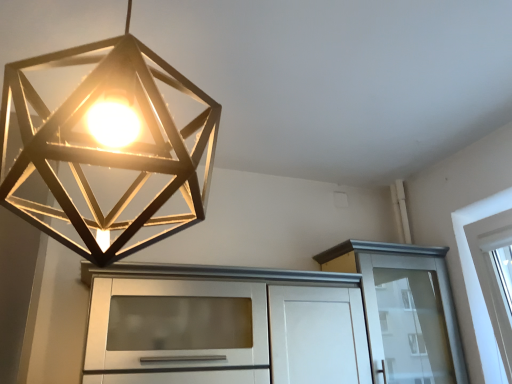
Question: Is white glossy cabinet at upper right, the 2th cabinetry from the left, outside of white glossy cabinet at center, the 2th cabinetry viewed from the right?

Choices:
 (A) yes
 (B) no

Answer: (A)

Question: Is white glossy cabinet at upper right, the 2th cabinetry from the left, thinner than white glossy cabinet at center, the 2th cabinetry viewed from the right?

Choices:
 (A) yes
 (B) no

Answer: (A)

Question: Would you say white glossy cabinet at center, the 2th cabinetry viewed from the right, is part of white glossy cabinet at upper right, positioned as the first cabinetry in right-to-left order,'s contents?

Choices:
 (A) no
 (B) yes

Answer: (A)

Question: Is white glossy cabinet at upper right, positioned as the first cabinetry in right-to-left order, at the right side of white glossy cabinet at center, the 2th cabinetry viewed from the right?

Choices:
 (A) yes
 (B) no

Answer: (A)

Question: From a real-world perspective, is white glossy cabinet at upper right, positioned as the first cabinetry in right-to-left order, beneath white glossy cabinet at center, the 2th cabinetry viewed from the right?

Choices:
 (A) no
 (B) yes

Answer: (A)

Question: Is white glossy cabinet at upper right, positioned as the first cabinetry in right-to-left order, placed right next to white glossy cabinet at center, the 2th cabinetry viewed from the right?

Choices:
 (A) no
 (B) yes

Answer: (A)

Question: Can we say white glossy cabinet at center, which appears as the first cabinetry when viewed from the left, lies outside metallic geometric light at upper center?

Choices:
 (A) yes
 (B) no

Answer: (A)

Question: Are white glossy cabinet at center, which appears as the first cabinetry when viewed from the left, and metallic geometric light at upper center beside each other?

Choices:
 (A) yes
 (B) no

Answer: (B)

Question: Does white glossy cabinet at center, the 2th cabinetry viewed from the right, have a smaller size compared to metallic geometric light at upper center?

Choices:
 (A) no
 (B) yes

Answer: (A)

Question: Is the position of white glossy cabinet at center, which appears as the first cabinetry when viewed from the left, less distant than that of metallic geometric light at upper center?

Choices:
 (A) no
 (B) yes

Answer: (A)

Question: Is the depth of white glossy cabinet at center, which appears as the first cabinetry when viewed from the left, greater than that of metallic geometric light at upper center?

Choices:
 (A) yes
 (B) no

Answer: (A)

Question: Considering the relative sizes of white glossy cabinet at center, the 2th cabinetry viewed from the right, and metallic geometric light at upper center in the image provided, is white glossy cabinet at center, the 2th cabinetry viewed from the right, shorter than metallic geometric light at upper center?

Choices:
 (A) no
 (B) yes

Answer: (B)

Question: Considering the relative sizes of metallic geometric light at upper center and white glossy cabinet at upper right, positioned as the first cabinetry in right-to-left order, in the image provided, is metallic geometric light at upper center taller than white glossy cabinet at upper right, positioned as the first cabinetry in right-to-left order,?

Choices:
 (A) no
 (B) yes

Answer: (B)